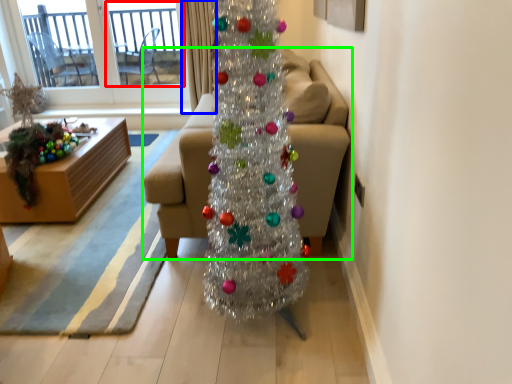
Question: Which object is the farthest from screen door (highlighted by a red box)? Choose among these: curtain (highlighted by a blue box) or studio couch (highlighted by a green box).

Choices:
 (A) curtain
 (B) studio couch

Answer: (B)